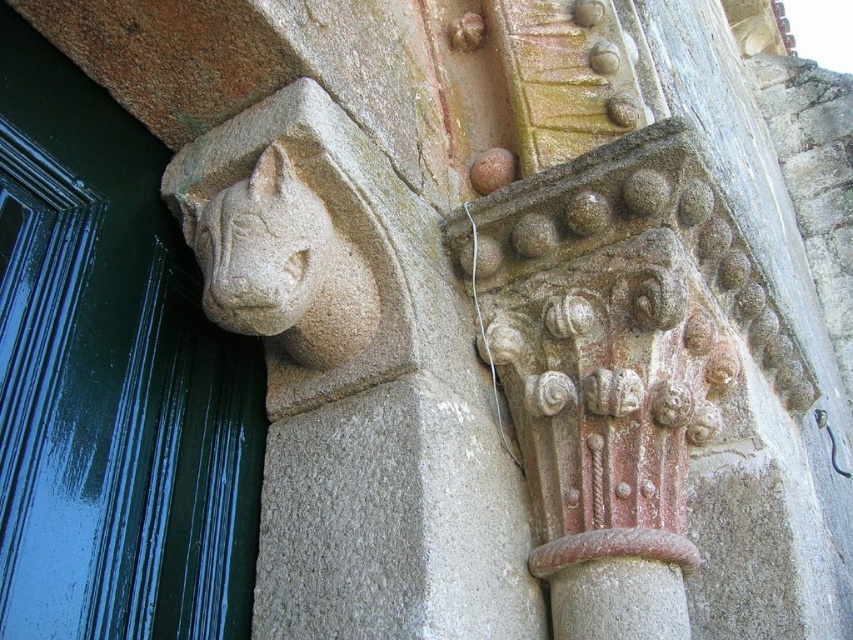
You are standing in front of the green glossy door at left and want to enter the building. Is the stone carved gargoyle at upper left blocking your path?

The green glossy door at left is in front of the stone carved gargoyle at upper left, so the gargoyle is behind the door and not blocking your path.

Looking at this image, you are an architect examining the building details. You notice the green glossy door at left and the stone carved gargoyle at upper left. Which object is positioned higher in the image?

The stone carved gargoyle at upper left is positioned higher than the green glossy door at left.